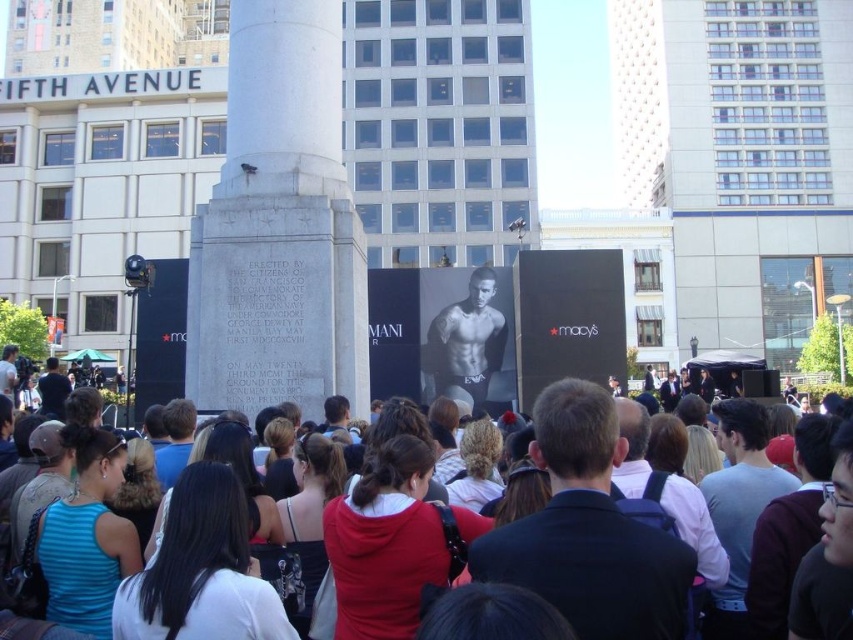
Question: Which point is farther from the camera taking this photo?

Choices:
 (A) [x=467, y=321]
 (B) [x=815, y=435]
 (C) [x=242, y=173]

Answer: (A)

Question: Among these points, which one is nearest to the camera?

Choices:
 (A) (433, 326)
 (B) (811, 449)

Answer: (B)

Question: Among these points, which one is farthest from the camera?

Choices:
 (A) (340, 380)
 (B) (456, 316)

Answer: (B)

Question: Is white marble monument at center above smooth skin torso at center?

Choices:
 (A) yes
 (B) no

Answer: (A)

Question: Can you confirm if dark blue hoodie at center is positioned above smooth skin torso at center?

Choices:
 (A) no
 (B) yes

Answer: (A)

Question: Does dark blue hoodie at center appear on the left side of smooth skin torso at center?

Choices:
 (A) no
 (B) yes

Answer: (A)